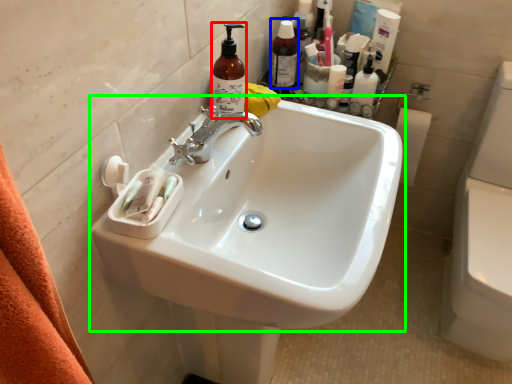
Question: Which is farther away from cleaning product (highlighted by a red box)? toiletry (highlighted by a blue box) or sink (highlighted by a green box)?

Choices:
 (A) toiletry
 (B) sink

Answer: (A)